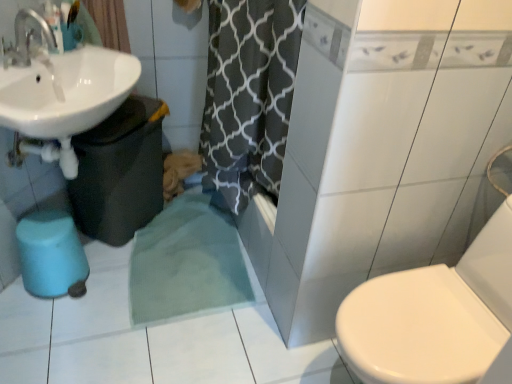
Question: Does white glossy sink at upper left contain cotton curtain at upper left?

Choices:
 (A) no
 (B) yes

Answer: (A)

Question: Is white glossy sink at upper left facing towards cotton curtain at upper left?

Choices:
 (A) no
 (B) yes

Answer: (A)

Question: Would you say white glossy sink at upper left is a long distance from cotton curtain at upper left?

Choices:
 (A) yes
 (B) no

Answer: (B)

Question: Considering the relative positions of white glossy sink at upper left and cotton curtain at upper left in the image provided, is white glossy sink at upper left to the left of cotton curtain at upper left from the viewer's perspective?

Choices:
 (A) yes
 (B) no

Answer: (A)

Question: From a real-world perspective, is white glossy sink at upper left below cotton curtain at upper left?

Choices:
 (A) yes
 (B) no

Answer: (A)

Question: Is white glossy sink at upper left bigger or smaller than cotton curtain at upper left?

Choices:
 (A) big
 (B) small

Answer: (A)

Question: Is white glossy sink at upper left wider or thinner than cotton curtain at upper left?

Choices:
 (A) wide
 (B) thin

Answer: (A)

Question: Is white glossy sink at upper left taller or shorter than cotton curtain at upper left?

Choices:
 (A) tall
 (B) short

Answer: (A)

Question: Is point click(1, 100) positioned closer to the camera than point click(100, 1)?

Choices:
 (A) closer
 (B) farther

Answer: (A)

Question: From the image's perspective, is blue rubber bidet at lower left located above or below cotton curtain at upper left?

Choices:
 (A) below
 (B) above

Answer: (A)

Question: Is point (54, 274) closer or farther from the camera than point (103, 9)?

Choices:
 (A) closer
 (B) farther

Answer: (A)

Question: In the image, is blue rubber bidet at lower left positioned in front of or behind cotton curtain at upper left?

Choices:
 (A) front
 (B) behind

Answer: (A)

Question: In terms of height, does blue rubber bidet at lower left look taller or shorter compared to cotton curtain at upper left?

Choices:
 (A) tall
 (B) short

Answer: (A)

Question: From their relative heights in the image, would you say cotton curtain at upper left is taller or shorter than blue rubber bidet at lower left?

Choices:
 (A) short
 (B) tall

Answer: (A)

Question: Considering the positions of cotton curtain at upper left and blue rubber bidet at lower left in the image, is cotton curtain at upper left bigger or smaller than blue rubber bidet at lower left?

Choices:
 (A) big
 (B) small

Answer: (B)